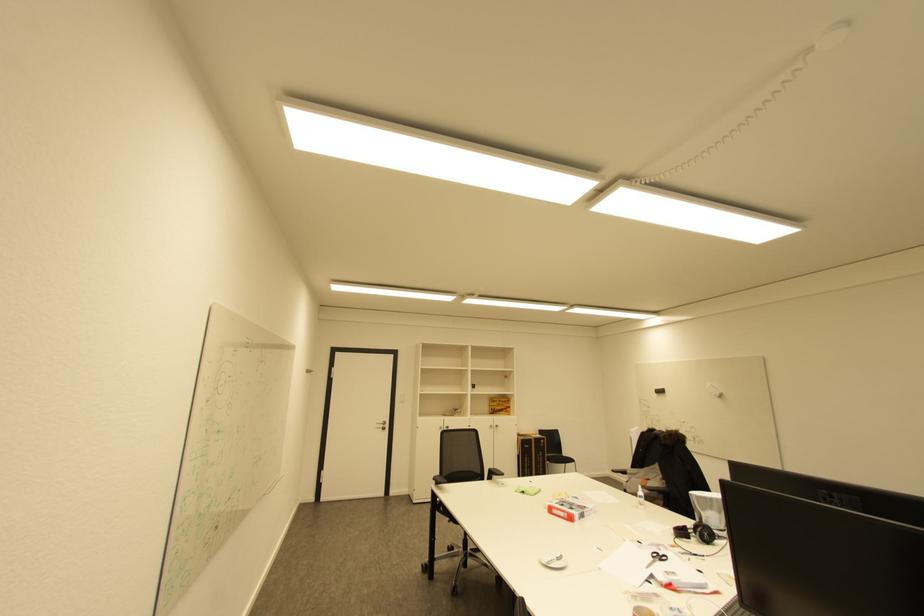
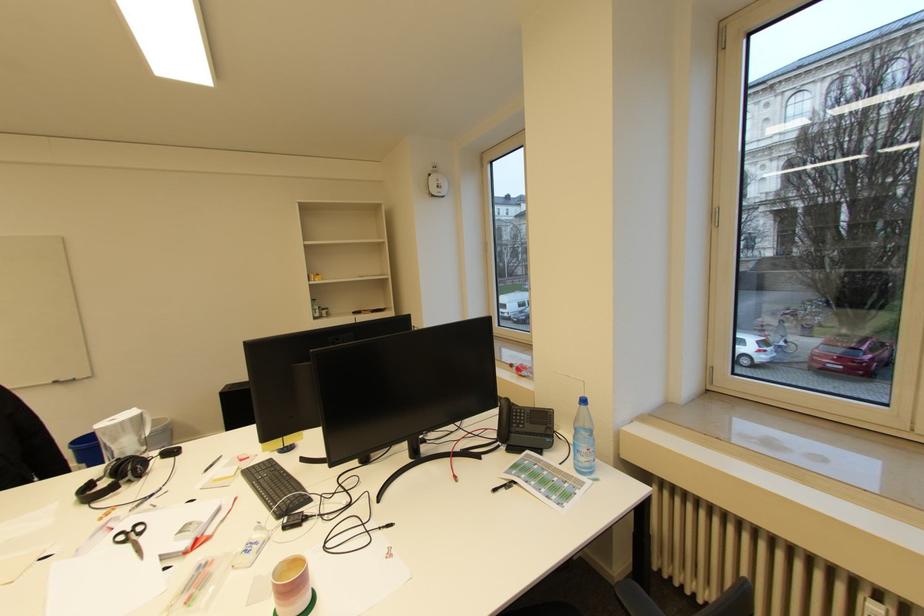
In the second image, find the point that corresponds to pixel 685 541 in the first image.

(100, 506)